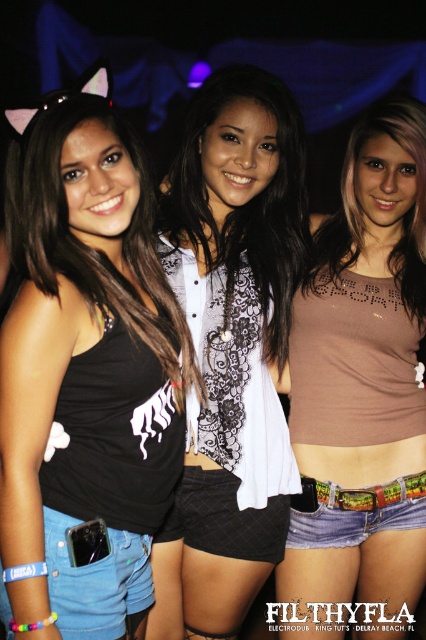
Question: Which of these objects is positioned closest to the multicolored printed fabric at lower center?

Choices:
 (A) brown matte tank top at center
 (B) white lace shirt at center
 (C) denim shorts at lower left

Answer: (A)

Question: Can you confirm if denim shorts at lower left is bigger than multicolored printed fabric at lower center?

Choices:
 (A) no
 (B) yes

Answer: (B)

Question: Among these objects, which one is nearest to the camera?

Choices:
 (A) multicolored printed fabric at lower center
 (B) denim shorts at lower left
 (C) black mesh shorts at center

Answer: (B)

Question: Which is nearer to the brown matte tank top at center?

Choices:
 (A) multicolored printed fabric at lower center
 (B) black mesh shorts at center

Answer: (A)

Question: Does black mesh shorts at center have a smaller size compared to multicolored printed fabric at lower center?

Choices:
 (A) yes
 (B) no

Answer: (B)

Question: From the image, what is the correct spatial relationship of white lace shirt at center in relation to black mesh shorts at center?

Choices:
 (A) above
 (B) below

Answer: (A)